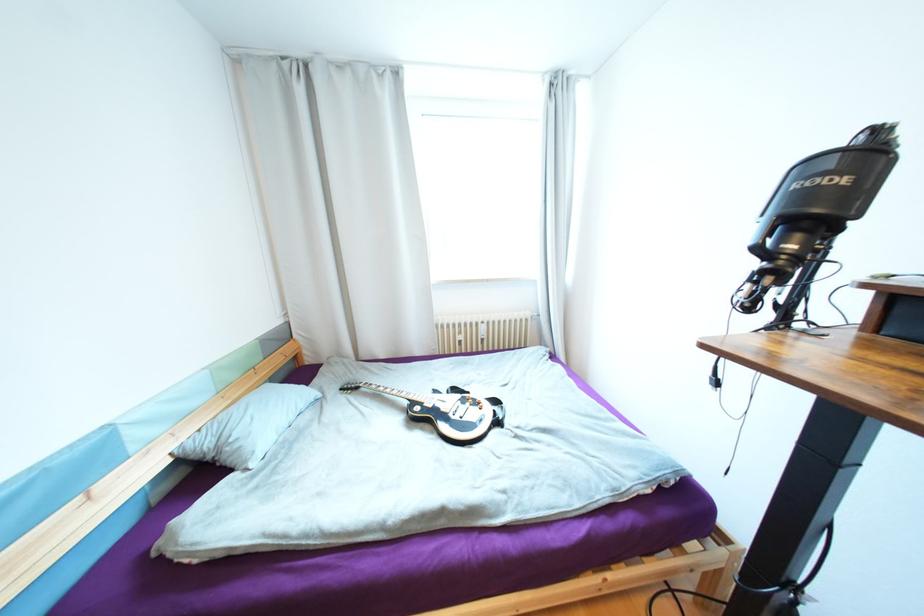
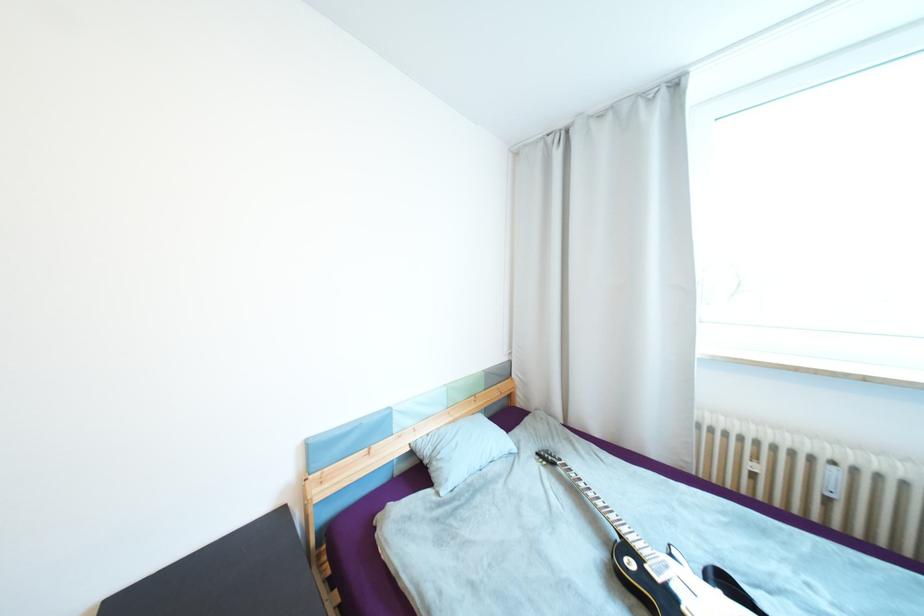
Question: The camera is either moving clockwise (left) or counter-clockwise (right) around the object. The first image is from the beginning of the video and the second image is from the end. Is the camera moving left or right when shooting the video?

Choices:
 (A) Left
 (B) Right

Answer: (B)